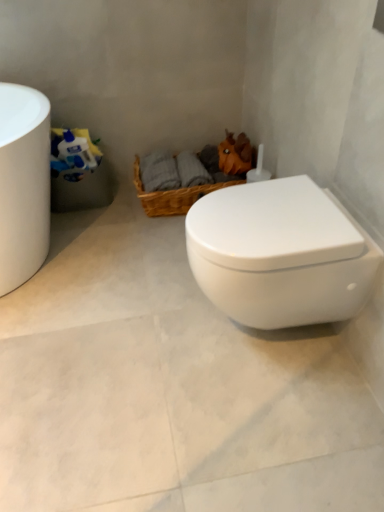
Find the location of a particular element. white glossy toilet at center is located at coordinates (170, 387).

Find the location of a particular element. white glossy toilet at center is located at coordinates (280, 254).

Where is `woven brown basket at center`? woven brown basket at center is located at coordinates (173, 195).

Do you think white glossy toilet at center is within white glossy toilet paper at left, or outside of it?

white glossy toilet at center is spatially situated outside white glossy toilet paper at left.

Is white glossy toilet at center facing away from white glossy toilet paper at left?

No, white glossy toilet at center is not facing away from white glossy toilet paper at left.

Based on their sizes in the image, would you say white glossy toilet at center is bigger or smaller than white glossy toilet paper at left?

Clearly, white glossy toilet at center is larger in size than white glossy toilet paper at left.

Is white glossy toilet at center thinner than white glossy toilet paper at left?

In fact, white glossy toilet at center might be wider than white glossy toilet paper at left.

Considering the points (233, 487) and (69, 174), which point is in front, point (233, 487) or point (69, 174)?

The point (233, 487) is closer.

Find the location of `toilet paper that is on the left side of white glossy toilet at center`. toilet paper that is on the left side of white glossy toilet at center is located at coordinates (73, 154).

From the picture: Is white glossy toilet at center smaller than white glossy toilet paper at left?

No.

Is white glossy toilet paper at left wider than white glossy toilet at center?

In fact, white glossy toilet paper at left might be narrower than white glossy toilet at center.

From the image's perspective, is white glossy toilet paper at left below white glossy toilet at center?

Actually, white glossy toilet paper at left appears above white glossy toilet at center in the image.

Is white glossy toilet paper at left aimed at white glossy toilet at center?

No, white glossy toilet paper at left is not aimed at white glossy toilet at center.

Which is further, (78,142) or (314,319)?

Positioned behind is point (78,142).

In terms of width, does white glossy toilet paper at left look wider or thinner when compared to white glossy toilet at center?

white glossy toilet paper at left is thinner than white glossy toilet at center.

Is white glossy toilet paper at left bigger than white glossy toilet at center?

No.

Can you tell me how much white glossy toilet at center and white glossy toilet at center differ in facing direction?

90.6 degrees.

From the image's perspective, is white glossy toilet at center located beneath white glossy toilet at center?

Yes.

Is there a large distance between white glossy toilet at center and white glossy toilet at center?

Actually, white glossy toilet at center and white glossy toilet at center are a little close together.

Is point (107, 266) positioned before point (209, 295)?

No, (107, 266) is behind (209, 295).

From a real-world perspective, who is located lower, white glossy toilet at center or woven brown basket at center?

woven brown basket at center is physically lower.

Which object is wider, white glossy toilet at center or woven brown basket at center?

woven brown basket at center.

In the scene shown: Is white glossy toilet at center oriented towards woven brown basket at center?

No, white glossy toilet at center is not turned towards woven brown basket at center.

Can you see white glossy toilet at center touching woven brown basket at center?

No, white glossy toilet at center is not beside woven brown basket at center.

Considering the sizes of white glossy toilet at center and woven brown basket at center in the image, is white glossy toilet at center taller or shorter than woven brown basket at center?

white glossy toilet at center is shorter than woven brown basket at center.

Would you say white glossy toilet at center contains woven brown basket at center?

Actually, woven brown basket at center is outside white glossy toilet at center.

Is white glossy toilet at center in front of or behind woven brown basket at center in the image?

white glossy toilet at center is in front of woven brown basket at center.

Where is `toilet below the white glossy toilet paper at left (from the image's perspective)`? toilet below the white glossy toilet paper at left (from the image's perspective) is located at coordinates (280, 254).

This screenshot has width=384, height=512. What are the coordinates of `toilet paper lying on the left of white glossy toilet at center` in the screenshot? It's located at (73, 154).

Based on their spatial positions, is white glossy toilet at center or white glossy toilet paper at left further from woven brown basket at center?

white glossy toilet at center.

Consider the image. Looking at the image, which one is located closer to white glossy toilet at center, white glossy toilet paper at left or woven brown basket at center?

woven brown basket at center.

Based on their spatial positions, is woven brown basket at center or white glossy toilet at center further from white glossy toilet paper at left?

The object further to white glossy toilet paper at left is white glossy toilet at center.

Estimate the real-world distances between objects in this image. Which object is further from white glossy toilet at center, white glossy toilet paper at left or white glossy toilet at center?

The object further to white glossy toilet at center is white glossy toilet paper at left.

Looking at this image, from the image, which object appears to be nearer to white glossy toilet at center, white glossy toilet at center or white glossy toilet paper at left?

Based on the image, white glossy toilet at center appears to be nearer to white glossy toilet at center.

Estimate the real-world distances between objects in this image. Which object is further from white glossy toilet paper at left, white glossy toilet at center or woven brown basket at center?

Among the two, white glossy toilet at center is located further to white glossy toilet paper at left.

Looking at this image, considering their positions, is white glossy toilet at center positioned further to white glossy toilet paper at left than white glossy toilet at center?

Based on the image, white glossy toilet at center appears to be further to white glossy toilet paper at left.

Which object lies further to the anchor point white glossy toilet paper at left, white glossy toilet at center or white glossy toilet at center?

white glossy toilet at center is further to white glossy toilet paper at left.

Find the location of a particular element. Image resolution: width=384 pixels, height=512 pixels. toilet paper between white glossy toilet at center and woven brown basket at center along the z-axis is located at coordinates (73, 154).

Identify the location of toilet between white glossy toilet at center and woven brown basket at center in the front-back direction. (280, 254).

Image resolution: width=384 pixels, height=512 pixels. I want to click on toilet between white glossy toilet at center and white glossy toilet paper at left along the z-axis, so click(x=280, y=254).

Where is `toilet paper between white glossy toilet at center and woven brown basket at center from front to back`? toilet paper between white glossy toilet at center and woven brown basket at center from front to back is located at coordinates (73, 154).